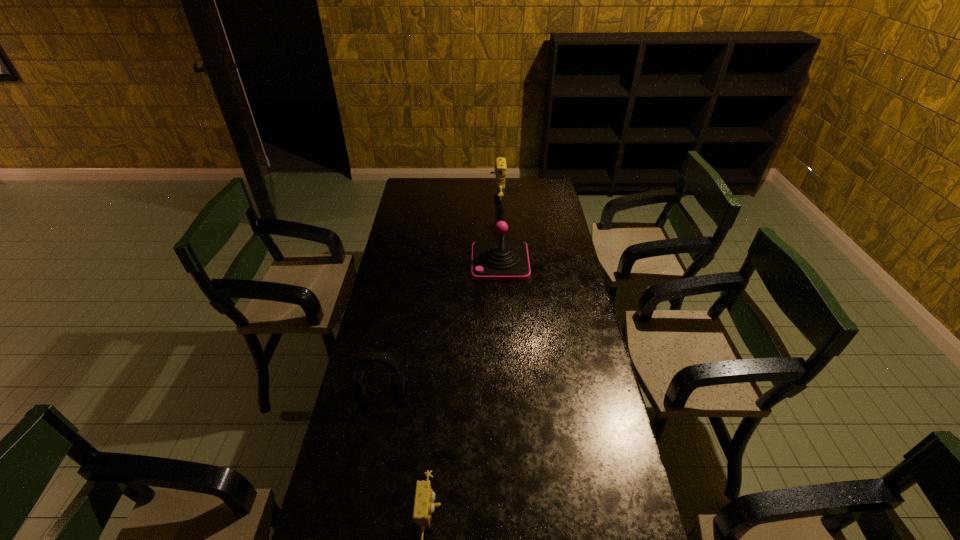
The image size is (960, 540). Find the location of `vacant space located forward from the base of the second farthest object`. vacant space located forward from the base of the second farthest object is located at coordinates (436, 262).

Find the location of a particular element. This screenshot has width=960, height=540. free region located on the headband of the second nearest object is located at coordinates (364, 474).

The height and width of the screenshot is (540, 960). I want to click on object that is at the far edge, so click(x=500, y=168).

You are a GUI agent. You are given a task and a screenshot of the screen. Output one action in this format:
    pyautogui.click(x=<x>, y=<y>)
    Task: Click on the object located at the left edge
    
    Given the screenshot: What is the action you would take?
    pyautogui.click(x=358, y=383)

Locate an element on the screen. Image resolution: width=960 pixels, height=540 pixels. vacant space at the far edge of the desktop is located at coordinates (516, 195).

The width and height of the screenshot is (960, 540). I want to click on vacant space at the left edge of the desktop, so click(372, 343).

You are a GUI agent. You are given a task and a screenshot of the screen. Output one action in this format:
    pyautogui.click(x=<x>, y=<y>)
    Task: Click on the vacant space at the right edge of the desktop
    
    Given the screenshot: What is the action you would take?
    pyautogui.click(x=602, y=420)

At what (x,y) coordinates should I click in order to perform the action: click on free spot at the far right corner of the desktop. Please return your answer as a coordinate pair (x, y). Looking at the image, I should click on (528, 184).

Identify the location of free space between the taller sponge and the headset. (439, 295).

At what (x,y) coordinates should I click in order to perform the action: click on vacant point located between the farthest object and the leftmost object. Please return your answer as a coordinate pair (x, y). This screenshot has width=960, height=540. Looking at the image, I should click on (439, 295).